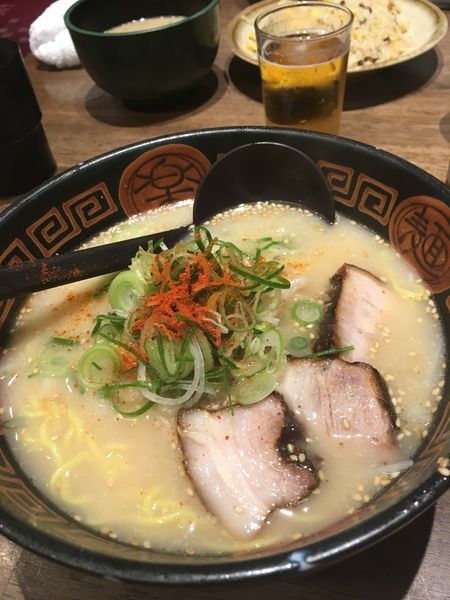
This screenshot has width=450, height=600. I want to click on drink in clear glass, so click(316, 94).